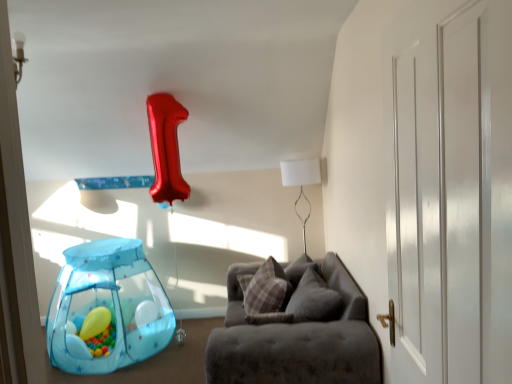
Question: From a real-world perspective, relative to translucent blue mesh tent at lower left, the first balloon in the right-to-left sequence, is white glossy door at right vertically above or below?

Choices:
 (A) above
 (B) below

Answer: (A)

Question: From the image's perspective, relative to translucent blue mesh tent at lower left, the second balloon viewed from the left, is white glossy door at right above or below?

Choices:
 (A) above
 (B) below

Answer: (A)

Question: Which is farther from the velvet grey couch at center?

Choices:
 (A) white matte table lamp at upper center
 (B) plaid fabric pillow at center
 (C) matte yellow balloon at lower left, which appears as the first balloon when viewed from the left
 (D) white glossy door at right
 (E) translucent blue mesh tent at lower left, the first balloon in the right-to-left sequence

Answer: (C)

Question: Estimate the real-world distances between objects in this image. Which object is farther from the matte yellow balloon at lower left, which ranks as the second balloon in right-to-left order?

Choices:
 (A) plaid fabric pillow at center
 (B) velvet grey couch at center
 (C) translucent blue mesh tent at lower left, the first balloon in the right-to-left sequence
 (D) white matte table lamp at upper center
 (E) white glossy door at right

Answer: (E)